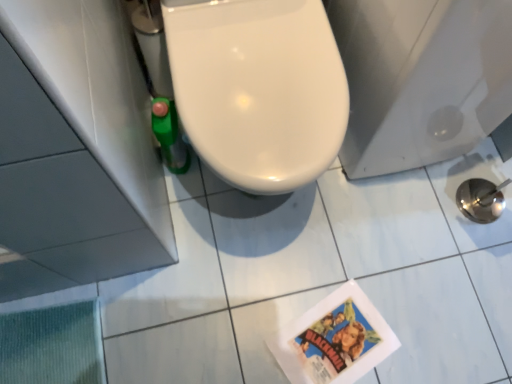
Question: Considering the positions of white glossy toilet at center and glossy ceramic tile at lower right in the image, is white glossy toilet at center taller or shorter than glossy ceramic tile at lower right?

Choices:
 (A) tall
 (B) short

Answer: (A)

Question: Is white glossy toilet at center inside the boundaries of glossy ceramic tile at lower right, or outside?

Choices:
 (A) inside
 (B) outside

Answer: (B)

Question: Does point (372, 9) appear closer or farther from the camera than point (468, 152)?

Choices:
 (A) closer
 (B) farther

Answer: (A)

Question: Looking at the image, does glossy ceramic tile at lower right seem bigger or smaller compared to white glossy toilet at center?

Choices:
 (A) big
 (B) small

Answer: (B)

Question: From a real-world perspective, is glossy ceramic tile at lower right physically located above or below white glossy toilet at center?

Choices:
 (A) below
 (B) above

Answer: (A)

Question: Is glossy ceramic tile at lower right wider or thinner than white glossy toilet at center?

Choices:
 (A) thin
 (B) wide

Answer: (A)

Question: Is glossy ceramic tile at lower right in front of or behind white glossy toilet at center in the image?

Choices:
 (A) behind
 (B) front

Answer: (A)